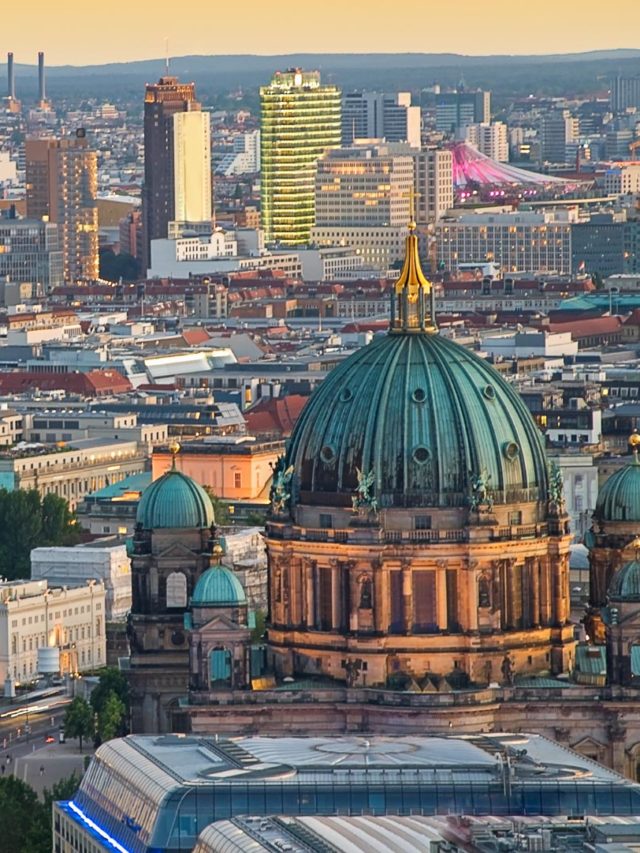
You are a GUI agent. You are given a task and a screenshot of the screen. Output one action in this format:
    pyautogui.click(x=<x>, y=<y>)
    Task: Click on the blue lighting
    The image size is (640, 853).
    Given the screenshot: What is the action you would take?
    pyautogui.click(x=102, y=833), pyautogui.click(x=92, y=821), pyautogui.click(x=83, y=811), pyautogui.click(x=118, y=846)